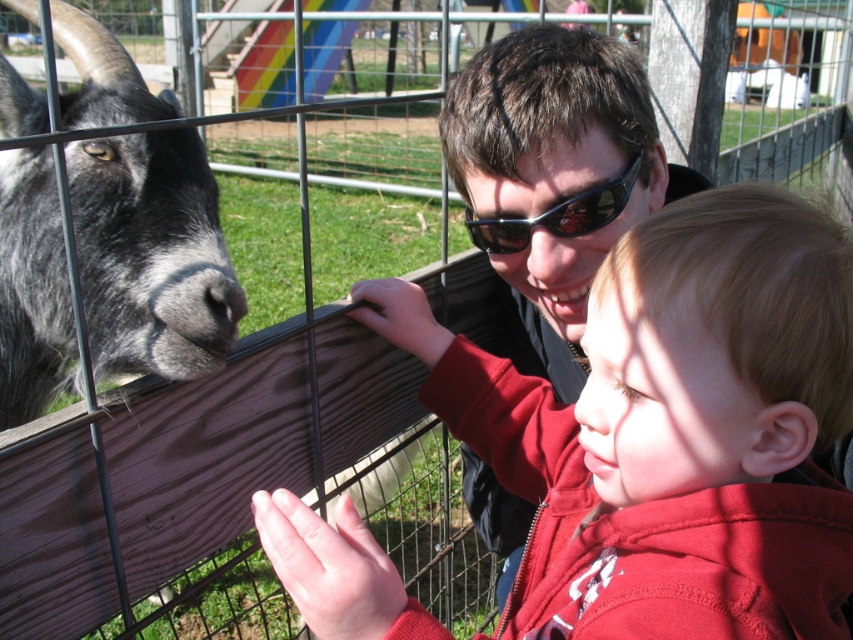
Question: Which object appears closest to the camera in this image?

Choices:
 (A) gray woolen goat at left
 (B) sunglasses at center

Answer: (A)

Question: Which is nearer to the sunglasses at center?

Choices:
 (A) matte red hoodie at center
 (B) gray woolen goat at left

Answer: (A)

Question: Is gray woolen goat at left positioned in front of sunglasses at center?

Choices:
 (A) no
 (B) yes

Answer: (B)

Question: Which object is the closest to the matte red hoodie at center?

Choices:
 (A) gray woolen goat at left
 (B) sunglasses at center

Answer: (B)

Question: From the image, what is the correct spatial relationship of gray woolen goat at left in relation to sunglasses at center?

Choices:
 (A) left
 (B) right

Answer: (A)

Question: Does gray woolen goat at left have a larger size compared to sunglasses at center?

Choices:
 (A) yes
 (B) no

Answer: (A)